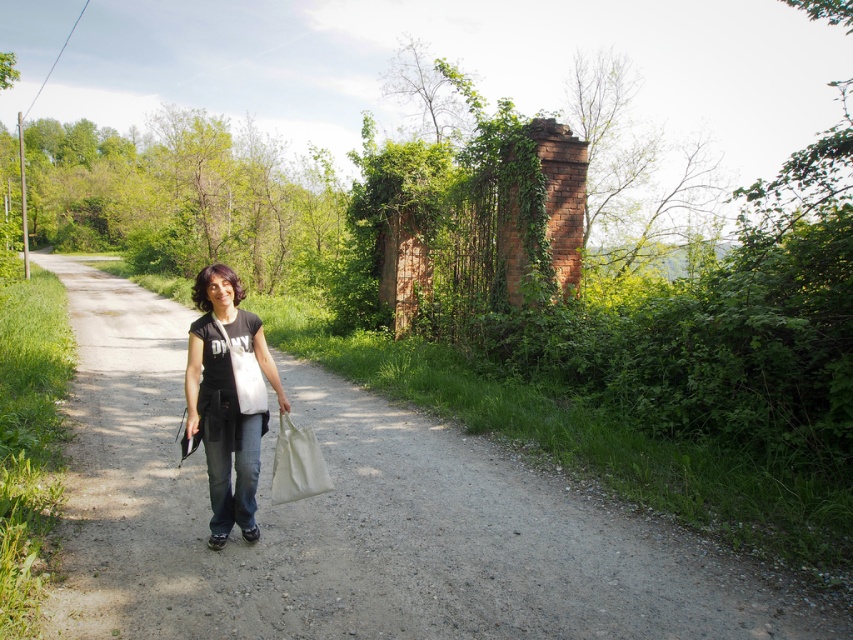
Is the position of gravel path at center more distant than that of black matte shirt at center?

No.

Is point (161, 502) positioned in front of point (254, 438)?

No, (161, 502) is further to viewer.

Between point (144, 440) and point (196, 404), which one is positioned in front?

Point (196, 404)

I want to click on gravel path at center, so click(x=360, y=520).

What do you see at coordinates (225, 401) in the screenshot?
I see `black matte shirt at center` at bounding box center [225, 401].

From the picture: Who is shorter, black matte shirt at center or white canvas bag at center?

white canvas bag at center is shorter.

Is point (202, 272) positioned after point (311, 480)?

No, it is in front of (311, 480).

Identify the location of black matte shirt at center. This screenshot has width=853, height=640. (225, 401).

Which of these two, gravel path at center or white canvas bag at center, stands taller?

gravel path at center

Which of these two, gravel path at center or white canvas bag at center, stands shorter?

With less height is white canvas bag at center.

Locate an element on the screen. gravel path at center is located at coordinates (360, 520).

You are a GUI agent. You are given a task and a screenshot of the screen. Output one action in this format:
    pyautogui.click(x=<x>, y=<y>)
    Task: Click on the gravel path at center
    
    Given the screenshot: What is the action you would take?
    pyautogui.click(x=360, y=520)